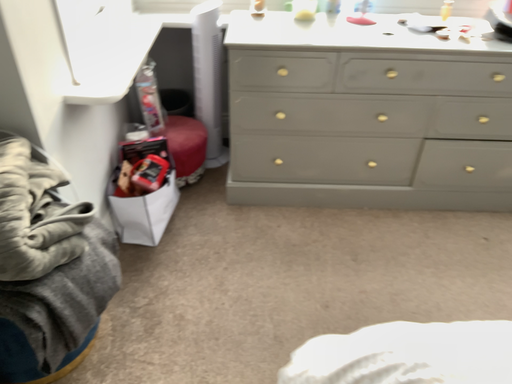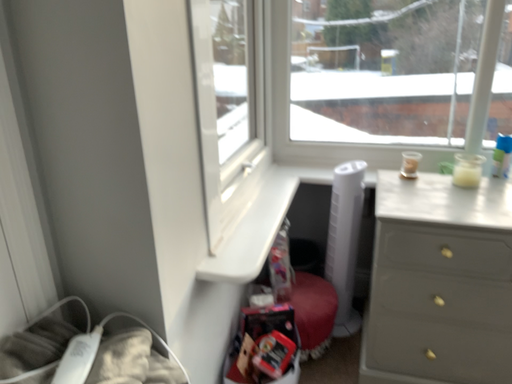
Question: Which way did the camera rotate in the video?

Choices:
 (A) rotated upward
 (B) rotated downward

Answer: (A)